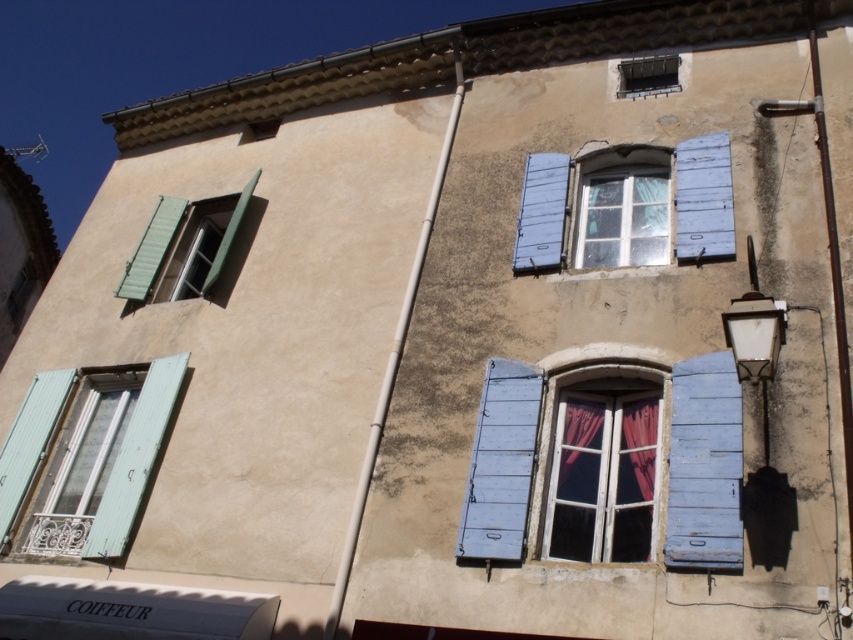
You are an architect assessing the building facade. You need to determine if a new decorative element that requires a minimum width of 1.2 meters can be placed on the white painted wood shutter at upper right or the green matte shutter at left. Based on their sizes, which shutter can accommodate this requirement?

The white painted wood shutter at upper right has a larger width than the green matte shutter at left. Since the decorative element requires a minimum of 1.2 meters, the white painted wood shutter at upper right is the only one capable of accommodating it, provided its width meets or exceeds the required measurement.

You are an architect inspecting the building. You notice the matte green shutters at left and the metallic gray window at upper center. Which of these two is located to the left of the other?

The matte green shutters at left is positioned on the left side of metallic gray window at upper center.

You are an architect inspecting the building. You notice the matte green shutters at left and the metallic gray window at upper center. Which object is located lower in the building?

The matte green shutters at left are positioned under the metallic gray window at upper center, so they are located lower in the building.